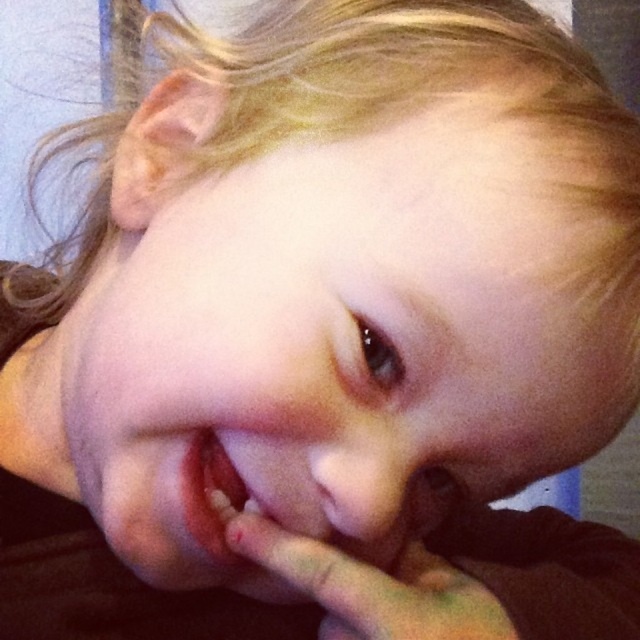
Does smooth skin face at center have a smaller size compared to smooth skin hand at lower center?

No, smooth skin face at center is not smaller than smooth skin hand at lower center.

Consider the image. Who is more forward, (x=515, y=476) or (x=445, y=621)?

Point (x=445, y=621) is in front.

Between point (128, 292) and point (380, 573), which one is positioned in front?

Point (380, 573) is more forward.

Where is `smooth skin face at center`? smooth skin face at center is located at coordinates (340, 339).

Consider the image. Is smooth skin face at center smaller than pink matte tooth at center?

No.

Who is lower down, smooth skin face at center or pink matte tooth at center?

Positioned lower is pink matte tooth at center.

The image size is (640, 640). Identify the location of smooth skin face at center. (340, 339).

This screenshot has width=640, height=640. Identify the location of smooth skin face at center. (340, 339).

Between smooth skin hand at lower center and pink matte tooth at center, which one has more height?

With more height is smooth skin hand at lower center.

Which is more to the right, smooth skin hand at lower center or pink matte tooth at center?

smooth skin hand at lower center

This screenshot has height=640, width=640. In order to click on smooth skin hand at lower center in this screenshot , I will do `click(371, 586)`.

Find the location of a particular element. The width and height of the screenshot is (640, 640). smooth skin hand at lower center is located at coordinates (371, 586).